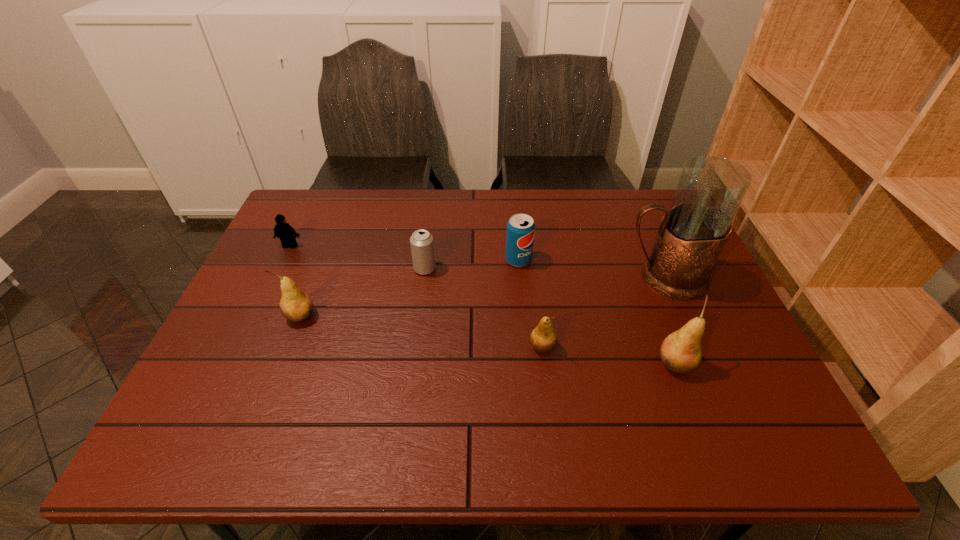
Locate an element on the screen. The height and width of the screenshot is (540, 960). object that is the fourth closest to the rightmost pear is located at coordinates (422, 246).

Identify which pear is the nearest to the second object from left to right. Please provide its 2D coordinates. Your answer should be formatted as a tuple, i.e. [(x, y)], where the tuple contains the x and y coordinates of a point satisfying the conditions above.

[(543, 338)]

At what (x,y) coordinates should I click in order to perform the action: click on pear that stands as the second closest to the second tallest pear. Please return your answer as a coordinate pair (x, y). The height and width of the screenshot is (540, 960). Looking at the image, I should click on (681, 351).

The image size is (960, 540). Find the location of `vacant space that satisfies the following two spatial constraints: 1. on the front side of the second pear from left to right; 2. on the right side of the rightmost pear`. vacant space that satisfies the following two spatial constraints: 1. on the front side of the second pear from left to right; 2. on the right side of the rightmost pear is located at coordinates (544, 363).

The image size is (960, 540). What are the coordinates of `vacant space that satisfies the following two spatial constraints: 1. on the face of the second pear from right to left; 2. on the right side of the farthest object` in the screenshot? It's located at [x=242, y=347].

Identify the location of blank space that satisfies the following two spatial constraints: 1. on the front side of the soda can; 2. on the left side of the rightmost pear. (528, 363).